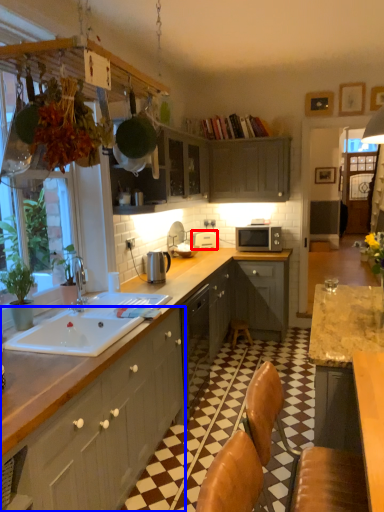
Question: Among these objects, which one is farthest to the camera, appliance (highlighted by a red box) or cabinetry (highlighted by a blue box)?

Choices:
 (A) appliance
 (B) cabinetry

Answer: (A)